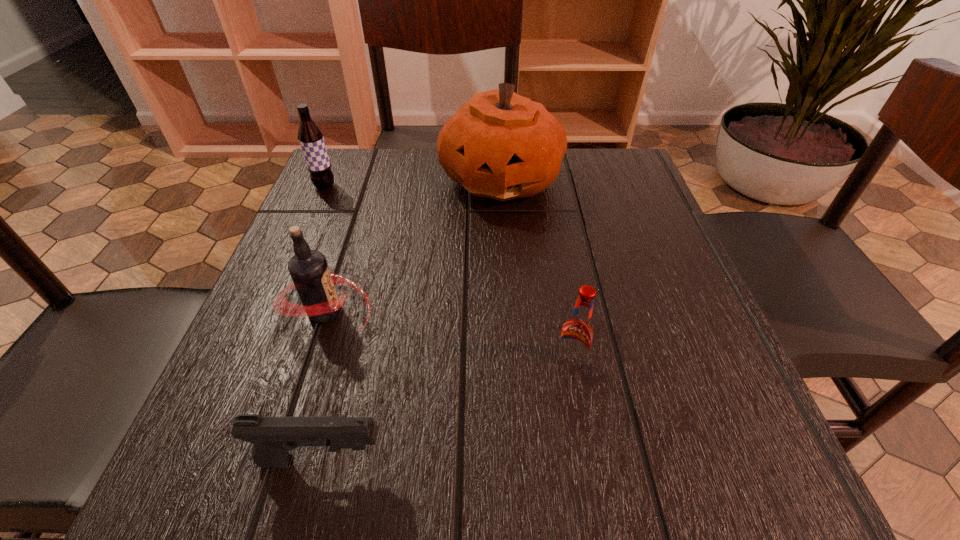
Where is `vacant space situated 0.070m on the front of the second nearest object`? Image resolution: width=960 pixels, height=540 pixels. vacant space situated 0.070m on the front of the second nearest object is located at coordinates (580, 420).

Locate an element on the screen. The width and height of the screenshot is (960, 540). free space located 0.210m at the barrel of the shortest object is located at coordinates (550, 461).

Find the location of a particular element. The width and height of the screenshot is (960, 540). pumpkin at the far edge is located at coordinates (500, 145).

Find the location of a particular element. root beer that is at the far edge is located at coordinates (310, 137).

I want to click on object present at the near edge, so click(273, 437).

I want to click on pistol situated at the left edge, so click(273, 437).

Find the location of a particular element. The height and width of the screenshot is (540, 960). object situated at the far left corner is located at coordinates (310, 137).

What are the coordinates of `object at the near left corner` in the screenshot? It's located at (273, 437).

You are a GUI agent. You are given a task and a screenshot of the screen. Output one action in this format:
    pyautogui.click(x=<x>, y=<y>)
    Task: Click on the vacant space at the far edge of the desktop
    The width and height of the screenshot is (960, 540).
    Given the screenshot: What is the action you would take?
    pyautogui.click(x=393, y=176)

Identify the location of blank space at the near edge of the desktop. The height and width of the screenshot is (540, 960). (468, 489).